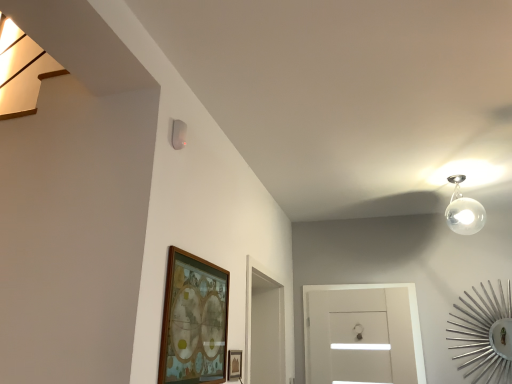
Question: From the image's perspective, is wooden framed artwork at lower center, the first picture frame when ordered from left to right, beneath wooden picture frame at lower center, which ranks as the 1th picture frame in right-to-left order?

Choices:
 (A) no
 (B) yes

Answer: (A)

Question: Is wooden framed artwork at lower center, which appears as the 2th picture frame when viewed from the right, at the left side of wooden picture frame at lower center, which ranks as the 1th picture frame in right-to-left order?

Choices:
 (A) no
 (B) yes

Answer: (B)

Question: Can you confirm if wooden framed artwork at lower center, which appears as the 2th picture frame when viewed from the right, is bigger than wooden picture frame at lower center, the second picture frame when ordered from left to right?

Choices:
 (A) yes
 (B) no

Answer: (A)

Question: Could wooden picture frame at lower center, which ranks as the 1th picture frame in right-to-left order, be considered to be inside wooden framed artwork at lower center, the first picture frame when ordered from left to right?

Choices:
 (A) yes
 (B) no

Answer: (B)

Question: Can we say wooden framed artwork at lower center, which appears as the 2th picture frame when viewed from the right, lies outside wooden picture frame at lower center, which ranks as the 1th picture frame in right-to-left order?

Choices:
 (A) no
 (B) yes

Answer: (B)

Question: Is wooden framed artwork at lower center, which appears as the 2th picture frame when viewed from the right, smaller than wooden picture frame at lower center, which ranks as the 1th picture frame in right-to-left order?

Choices:
 (A) no
 (B) yes

Answer: (A)

Question: Does wooden framed artwork at lower center, which appears as the 2th picture frame when viewed from the right, lie in front of transparent glass door at center?

Choices:
 (A) no
 (B) yes

Answer: (B)

Question: Does wooden framed artwork at lower center, the first picture frame when ordered from left to right, have a lesser height compared to transparent glass door at center?

Choices:
 (A) yes
 (B) no

Answer: (A)

Question: From a real-world perspective, is wooden framed artwork at lower center, the first picture frame when ordered from left to right, positioned over transparent glass door at center based on gravity?

Choices:
 (A) yes
 (B) no

Answer: (A)

Question: Is wooden framed artwork at lower center, the first picture frame when ordered from left to right, outside transparent glass door at center?

Choices:
 (A) yes
 (B) no

Answer: (A)

Question: Is wooden framed artwork at lower center, the first picture frame when ordered from left to right, wider than transparent glass door at center?

Choices:
 (A) yes
 (B) no

Answer: (B)

Question: Can you confirm if wooden framed artwork at lower center, the first picture frame when ordered from left to right, is taller than transparent glass door at center?

Choices:
 (A) yes
 (B) no

Answer: (B)

Question: Is wooden picture frame at lower center, the second picture frame when ordered from left to right, to the right of wooden framed artwork at lower center, which appears as the 2th picture frame when viewed from the right, from the viewer's perspective?

Choices:
 (A) yes
 (B) no

Answer: (A)